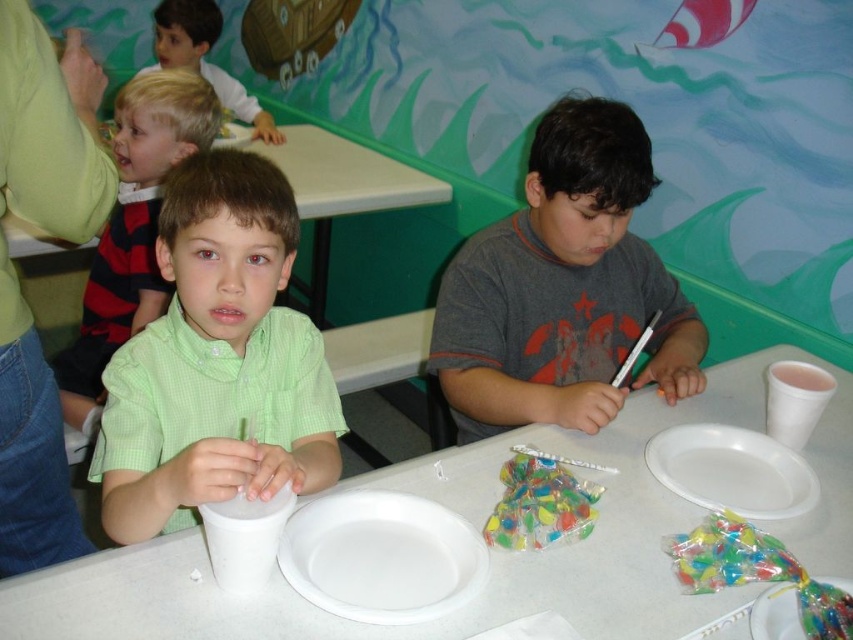
You are standing at the entrance of the room and want to find the white plastic table at center. According to the coordinates given, where should you look to locate it?

The white plastic table at center is located at coordinates point (479,529), so you should look towards the lower right area of the image to find it.

You are a parent at the party and want to place a small toy between the translucent plastic candy at lower right and the white matte paper cup at lower left. Which object should you place the toy closer to if you want it to be at the same height as the candy?

You should place the toy closer to the translucent plastic candy at lower right because it has a lesser height compared to the white matte paper cup at lower left, so the toy will align in height with the candy.